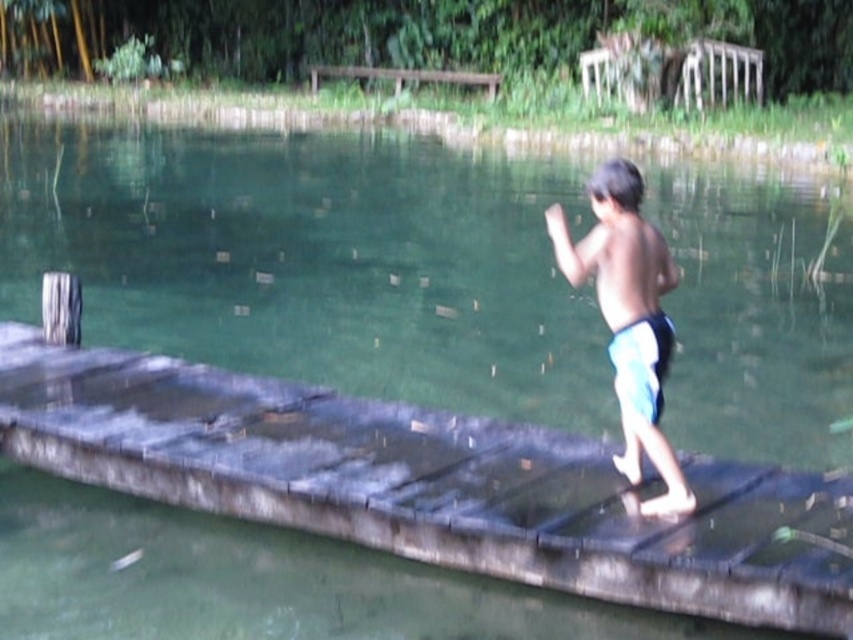
You are a photographer positioned at the edge of the wooden platform. You want to take a photo of the two points mentioned. Which point, point (653,378) or point (418,72), will appear larger in your photo?

Point (653,378) will appear larger in the photo because it is closer to the camera than point (418,72).